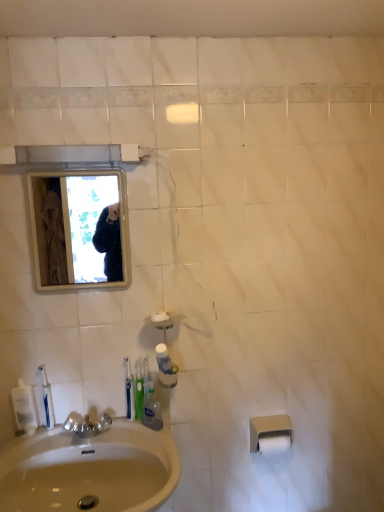
Where is `free location in front of green plastic toothbrush at sink, the second toothbrush in the left-to-right sequence`? This screenshot has height=512, width=384. free location in front of green plastic toothbrush at sink, the second toothbrush in the left-to-right sequence is located at coordinates (138, 439).